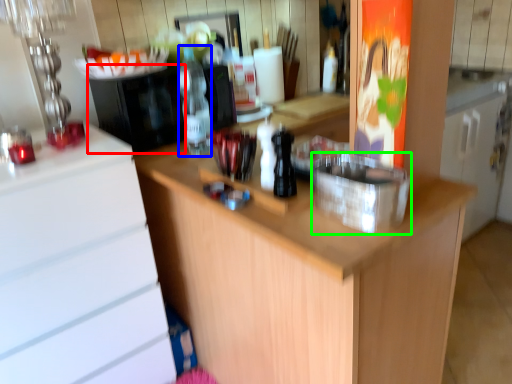
Question: Considering the real-world distances, which object is farthest from appliance (highlighted by a red box)? bottle (highlighted by a blue box) or appliance (highlighted by a green box)?

Choices:
 (A) bottle
 (B) appliance

Answer: (B)